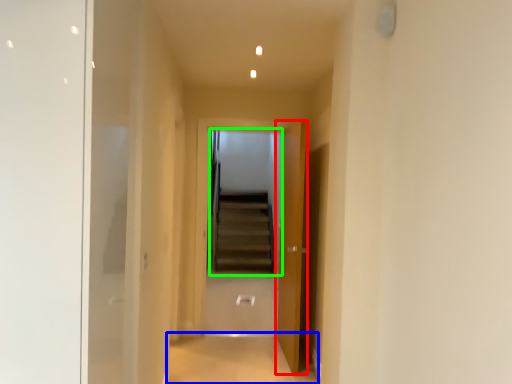
Question: Which object is the closest to the door (highlighted by a red box)? Choose among these: path (highlighted by a blue box) or escalator (highlighted by a green box).

Choices:
 (A) path
 (B) escalator

Answer: (A)